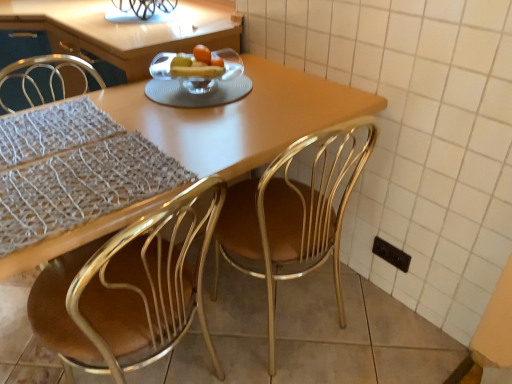
Question: Is clear glass bowl at center bigger than metallic gold chair at center, the 1th chair in the right-to-left sequence?

Choices:
 (A) no
 (B) yes

Answer: (A)

Question: Considering the relative sizes of clear glass bowl at center and metallic gold chair at center, the 1th chair in the right-to-left sequence, in the image provided, is clear glass bowl at center wider than metallic gold chair at center, the 1th chair in the right-to-left sequence,?

Choices:
 (A) yes
 (B) no

Answer: (B)

Question: Is clear glass bowl at center positioned with its back to metallic gold chair at center, which is counted as the 2th chair, starting from the left?

Choices:
 (A) yes
 (B) no

Answer: (B)

Question: Is clear glass bowl at center not within metallic gold chair at center, which is counted as the 2th chair, starting from the left?

Choices:
 (A) no
 (B) yes

Answer: (B)

Question: From a real-world perspective, is clear glass bowl at center below metallic gold chair at center, which is counted as the 2th chair, starting from the left?

Choices:
 (A) no
 (B) yes

Answer: (A)

Question: From a real-world perspective, is clear glass bowl at center above or below matte wooden table at center?

Choices:
 (A) below
 (B) above

Answer: (B)

Question: Considering the relative positions of clear glass bowl at center and matte wooden table at center in the image provided, is clear glass bowl at center to the left or to the right of matte wooden table at center?

Choices:
 (A) left
 (B) right

Answer: (B)

Question: From the image's perspective, is clear glass bowl at center located above or below matte wooden table at center?

Choices:
 (A) above
 (B) below

Answer: (A)

Question: Is clear glass bowl at center in front of or behind matte wooden table at center in the image?

Choices:
 (A) front
 (B) behind

Answer: (B)

Question: Is point (111, 264) closer or farther from the camera than point (215, 269)?

Choices:
 (A) farther
 (B) closer

Answer: (B)

Question: From the image's perspective, is gold metallic chair at center, which is the first chair from left to right, located above or below metallic gold chair at center, which is counted as the 2th chair, starting from the left?

Choices:
 (A) below
 (B) above

Answer: (A)

Question: Is gold metallic chair at center, positioned as the 2th chair in right-to-left order, taller or shorter than metallic gold chair at center, which is counted as the 2th chair, starting from the left?

Choices:
 (A) short
 (B) tall

Answer: (A)

Question: Considering the positions of gold metallic chair at center, which is the first chair from left to right, and metallic gold chair at center, the 1th chair in the right-to-left sequence, in the image, is gold metallic chair at center, which is the first chair from left to right, bigger or smaller than metallic gold chair at center, the 1th chair in the right-to-left sequence,?

Choices:
 (A) big
 (B) small

Answer: (A)

Question: From a real-world perspective, is matte wooden table at center physically located above or below black plastic electric outlet at lower right?

Choices:
 (A) below
 (B) above

Answer: (B)

Question: Does point (194, 140) appear closer or farther from the camera than point (385, 249)?

Choices:
 (A) closer
 (B) farther

Answer: (A)